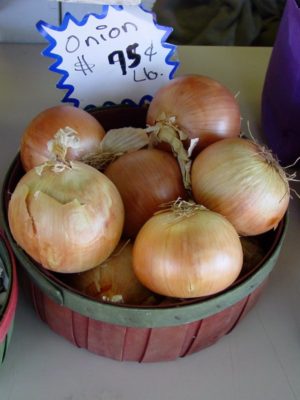
Find the location of `basket`. basket is located at coordinates (11, 279).